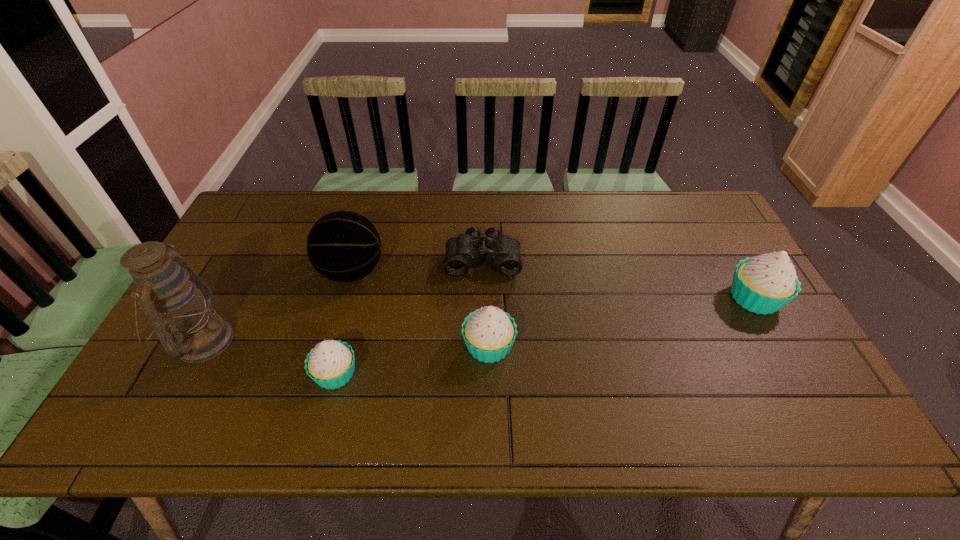
At what (x,y) coordinates should I click in order to perform the action: click on free spot between the binoculars and the basketball. Please return your answer as a coordinate pair (x, y). The width and height of the screenshot is (960, 540). Looking at the image, I should click on (418, 266).

At what (x,y) coordinates should I click in order to perform the action: click on unoccupied area between the basketball and the tallest object. Please return your answer as a coordinate pair (x, y). Looking at the image, I should click on (277, 306).

The width and height of the screenshot is (960, 540). Identify the location of vacant region between the basketball and the leftmost object. (277, 306).

Identify the location of object that is the third nearest to the basketball. (330, 364).

Locate which object is the third closest to the basketball. Please provide its 2D coordinates. Your answer should be formatted as a tuple, i.e. [(x, y)], where the tuple contains the x and y coordinates of a point satisfying the conditions above.

[(330, 364)]

Find the location of a particular element. This screenshot has height=540, width=960. cupcake that is the nearest to the basketball is located at coordinates (x=330, y=364).

Select which cupcake appears as the second closest to the leftmost object. Please provide its 2D coordinates. Your answer should be formatted as a tuple, i.e. [(x, y)], where the tuple contains the x and y coordinates of a point satisfying the conditions above.

[(489, 333)]

You are a GUI agent. You are given a task and a screenshot of the screen. Output one action in this format:
    pyautogui.click(x=<x>, y=<y>)
    Task: Click on the vacant space that satisfies the following two spatial constraints: 1. at the eyepieces of the binoculars; 2. on the right side of the farthest cupcake
    
    Given the screenshot: What is the action you would take?
    pyautogui.click(x=483, y=298)

At what (x,y) coordinates should I click in order to perform the action: click on free point that satisfies the following two spatial constraints: 1. on the back side of the farthest cupcake; 2. on the right side of the fifth tallest object. Please return your answer as a coordinate pair (x, y). The height and width of the screenshot is (540, 960). Looking at the image, I should click on (355, 298).

At what (x,y) coordinates should I click in order to perform the action: click on vacant space that satisfies the following two spatial constraints: 1. on the back side of the basketball; 2. on the right side of the leftmost object. Please return your answer as a coordinate pair (x, y). The width and height of the screenshot is (960, 540). Looking at the image, I should click on (239, 272).